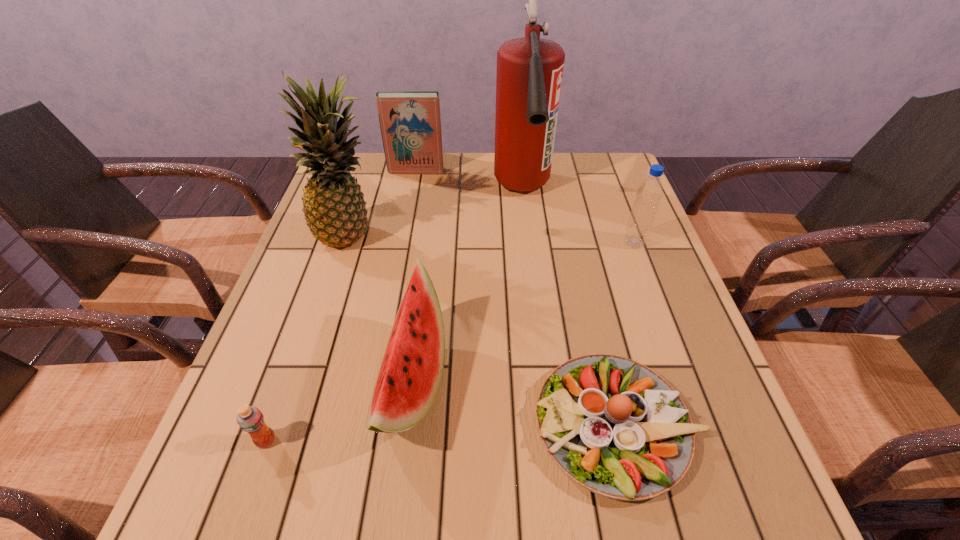
The image size is (960, 540). Identify the location of the tallest object. (529, 75).

Locate an element on the screen. The image size is (960, 540). the sixth shortest object is located at coordinates (333, 204).

Where is `hardback book`? This screenshot has width=960, height=540. hardback book is located at coordinates (410, 123).

Locate an element on the screen. The height and width of the screenshot is (540, 960). water bottle is located at coordinates (649, 193).

Image resolution: width=960 pixels, height=540 pixels. What are the coordinates of `the third shortest object` in the screenshot? It's located at (409, 378).

Identify the location of orange juice. This screenshot has width=960, height=540. (250, 419).

The height and width of the screenshot is (540, 960). I want to click on the shortest object, so click(x=614, y=426).

At what (x,y) coordinates should I click in order to perform the action: click on vacant space positioned at the nozzle of the fire extinguisher. Please return your answer as a coordinate pair (x, y). Looking at the image, I should click on (537, 317).

In order to click on free space located 0.090m on the front of the pineapple in this screenshot , I will do `click(334, 286)`.

You are a GUI agent. You are given a task and a screenshot of the screen. Output one action in this format:
    pyautogui.click(x=<x>, y=<y>)
    Task: Click on the free space located 0.130m on the cover of the hardback book
    This screenshot has width=960, height=540.
    Given the screenshot: What is the action you would take?
    pyautogui.click(x=410, y=199)